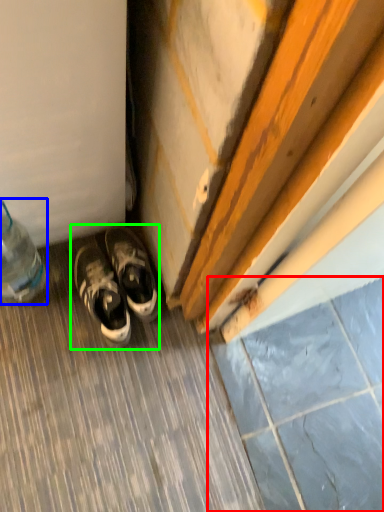
Question: Which is farther away from tile (highlighted by a red box)? bottle (highlighted by a blue box) or footwear (highlighted by a green box)?

Choices:
 (A) bottle
 (B) footwear

Answer: (A)